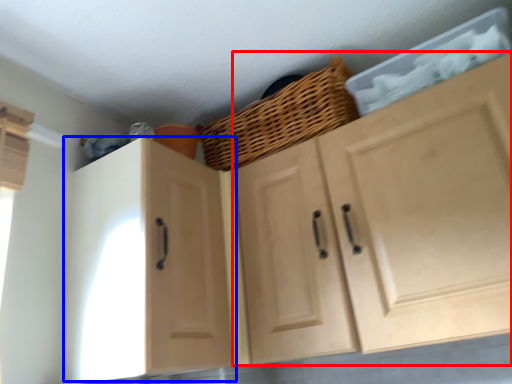
Question: Which of the following is the closest to the observer, cabinetry (highlighted by a red box) or cabinetry (highlighted by a blue box)?

Choices:
 (A) cabinetry
 (B) cabinetry

Answer: (A)